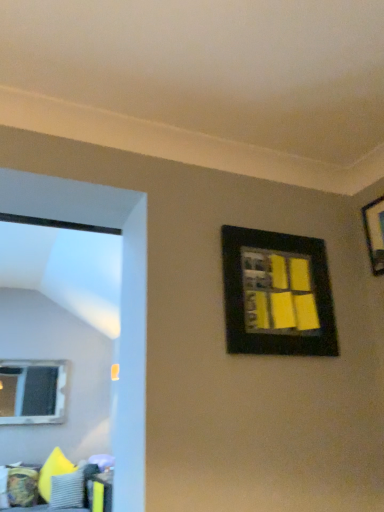
What do you see at coordinates (375, 233) in the screenshot? Image resolution: width=384 pixels, height=512 pixels. I see `black matte picture frame at upper right, the first picture frame in the right-to-left sequence` at bounding box center [375, 233].

The height and width of the screenshot is (512, 384). I want to click on clear glass window at left, so click(34, 391).

Locate an element on the screen. The image size is (384, 512). gray textured pillow at lower left is located at coordinates (68, 490).

From a real-world perspective, relative to gray textured pillow at lower left, is black matte picture frame at upper right, the 2th picture frame when ordered from right to left, vertically above or below?

In terms of real-world spatial position, black matte picture frame at upper right, the 2th picture frame when ordered from right to left, is above gray textured pillow at lower left.

Measure the distance between black matte picture frame at upper right, acting as the 1th picture frame starting from the left, and gray textured pillow at lower left.

black matte picture frame at upper right, acting as the 1th picture frame starting from the left, is 12.55 feet from gray textured pillow at lower left.

Which is in front, point (260, 271) or point (82, 466)?

The point (260, 271) is more forward.

Which is more to the right, black matte picture frame at upper right, the 2th picture frame when ordered from right to left, or gray textured pillow at lower left?

Positioned to the right is black matte picture frame at upper right, the 2th picture frame when ordered from right to left.

Which object is wider, textured fabric couch at lower left or gray textured pillow at lower left?

Wider between the two is textured fabric couch at lower left.

Is textured fabric couch at lower left to the right of gray textured pillow at lower left from the viewer's perspective?

No.

From the picture: Which is correct: textured fabric couch at lower left is inside gray textured pillow at lower left, or outside of it?

textured fabric couch at lower left is located beyond the bounds of gray textured pillow at lower left.

Could you tell me if textured fabric couch at lower left is turned towards gray textured pillow at lower left?

Yes, textured fabric couch at lower left is aimed at gray textured pillow at lower left.

Image resolution: width=384 pixels, height=512 pixels. I want to click on the 2nd picture frame to the right of the gray textured pillow at lower left, starting your count from the anchor, so click(375, 233).

How many degrees apart are the facing directions of gray textured pillow at lower left and black matte picture frame at upper right, the first picture frame in the right-to-left sequence?

gray textured pillow at lower left and black matte picture frame at upper right, the first picture frame in the right-to-left sequence, are facing 61.1 degrees away from each other.

Is gray textured pillow at lower left aimed at black matte picture frame at upper right, the first picture frame in the right-to-left sequence?

No, gray textured pillow at lower left is not facing towards black matte picture frame at upper right, the first picture frame in the right-to-left sequence.

Considering the relative positions of gray textured pillow at lower left and black matte picture frame at upper right, which is the 2th picture frame from left to right, in the image provided, is gray textured pillow at lower left to the left or to the right of black matte picture frame at upper right, which is the 2th picture frame from left to right,?

In the image, gray textured pillow at lower left appears on the left side of black matte picture frame at upper right, which is the 2th picture frame from left to right.

Measure the distance from black matte picture frame at upper right, the 2th picture frame when ordered from right to left, to clear glass window at left.

black matte picture frame at upper right, the 2th picture frame when ordered from right to left, is 5.01 meters away from clear glass window at left.

Considering the relative sizes of black matte picture frame at upper right, acting as the 1th picture frame starting from the left, and clear glass window at left in the image provided, is black matte picture frame at upper right, acting as the 1th picture frame starting from the left, bigger than clear glass window at left?

Actually, black matte picture frame at upper right, acting as the 1th picture frame starting from the left, might be smaller than clear glass window at left.

Is black matte picture frame at upper right, the 2th picture frame when ordered from right to left, far away from clear glass window at left?

Absolutely, black matte picture frame at upper right, the 2th picture frame when ordered from right to left, is distant from clear glass window at left.

Is black matte picture frame at upper right, the 2th picture frame when ordered from right to left, not within clear glass window at left?

Yes, black matte picture frame at upper right, the 2th picture frame when ordered from right to left, is not within clear glass window at left.

Considering their positions, is clear glass window at left located in front of or behind textured fabric couch at lower left?

Clearly, clear glass window at left is behind textured fabric couch at lower left.

From a real-world perspective, which object rests below the other?

textured fabric couch at lower left.

Is clear glass window at left aimed at textured fabric couch at lower left?

No, clear glass window at left is not turned towards textured fabric couch at lower left.

Considering the relative sizes of clear glass window at left and textured fabric couch at lower left in the image provided, is clear glass window at left taller than textured fabric couch at lower left?

Correct, clear glass window at left is much taller as textured fabric couch at lower left.

Does point (66, 492) appear closer or farther from the camera than point (79, 492)?

Point (66, 492).

Could you tell me if gray textured pillow at lower left is facing textured fabric couch at lower left?

Yes.

Is gray textured pillow at lower left not inside textured fabric couch at lower left?

No, gray textured pillow at lower left is inside textured fabric couch at lower left's boundary.

Is gray textured pillow at lower left taller or shorter than textured fabric couch at lower left?

In the image, gray textured pillow at lower left appears to be shorter than textured fabric couch at lower left.

Between black matte picture frame at upper right, acting as the 1th picture frame starting from the left, and textured fabric couch at lower left, which one has larger width?

textured fabric couch at lower left is wider.

Which object is more forward, black matte picture frame at upper right, the 2th picture frame when ordered from right to left, or textured fabric couch at lower left?

Positioned in front is black matte picture frame at upper right, the 2th picture frame when ordered from right to left.

From a real-world perspective, who is located lower, black matte picture frame at upper right, acting as the 1th picture frame starting from the left, or textured fabric couch at lower left?

In real-world perspective, textured fabric couch at lower left is lower.

Is black matte picture frame at upper right, acting as the 1th picture frame starting from the left, taller than textured fabric couch at lower left?

In fact, black matte picture frame at upper right, acting as the 1th picture frame starting from the left, may be shorter than textured fabric couch at lower left.

At what (x,y) coordinates should I click in order to perform the action: click on picture frame that is the 2nd object located in front of the gray textured pillow at lower left. Please return your answer as a coordinate pair (x, y). The width and height of the screenshot is (384, 512). Looking at the image, I should click on (277, 294).

The height and width of the screenshot is (512, 384). Identify the location of pillow lying above the textured fabric couch at lower left (from the image's perspective). (68, 490).

In the scene shown: When comparing their distances from gray textured pillow at lower left, does black matte picture frame at upper right, which is the 2th picture frame from left to right, or textured fabric couch at lower left seem further?

black matte picture frame at upper right, which is the 2th picture frame from left to right, lies further to gray textured pillow at lower left than the other object.

From the picture: When comparing their distances from black matte picture frame at upper right, which is the 2th picture frame from left to right, does textured fabric couch at lower left or clear glass window at left seem further?

clear glass window at left lies further to black matte picture frame at upper right, which is the 2th picture frame from left to right, than the other object.

Estimate the real-world distances between objects in this image. Which object is further from gray textured pillow at lower left, clear glass window at left or textured fabric couch at lower left?

clear glass window at left.

Based on their spatial positions, is textured fabric couch at lower left or gray textured pillow at lower left further from black matte picture frame at upper right, which is the 2th picture frame from left to right?

Based on the image, gray textured pillow at lower left appears to be further to black matte picture frame at upper right, which is the 2th picture frame from left to right.

Considering their positions, is clear glass window at left positioned further to textured fabric couch at lower left than black matte picture frame at upper right, acting as the 1th picture frame starting from the left?

black matte picture frame at upper right, acting as the 1th picture frame starting from the left, is further to textured fabric couch at lower left.

Looking at the image, which one is located closer to black matte picture frame at upper right, which is the 2th picture frame from left to right, clear glass window at left or black matte picture frame at upper right, acting as the 1th picture frame starting from the left?

black matte picture frame at upper right, acting as the 1th picture frame starting from the left.

Looking at the image, which one is located closer to black matte picture frame at upper right, the first picture frame in the right-to-left sequence, gray textured pillow at lower left or black matte picture frame at upper right, the 2th picture frame when ordered from right to left?

black matte picture frame at upper right, the 2th picture frame when ordered from right to left, is positioned closer to the anchor black matte picture frame at upper right, the first picture frame in the right-to-left sequence.

Estimate the real-world distances between objects in this image. Which object is further from textured fabric couch at lower left, black matte picture frame at upper right, the first picture frame in the right-to-left sequence, or black matte picture frame at upper right, acting as the 1th picture frame starting from the left?

The object further to textured fabric couch at lower left is black matte picture frame at upper right, the first picture frame in the right-to-left sequence.

You are a GUI agent. You are given a task and a screenshot of the screen. Output one action in this format:
    pyautogui.click(x=<x>, y=<y>)
    Task: Click on the furniture between black matte picture frame at upper right, acting as the 1th picture frame starting from the left, and gray textured pillow at lower left, along the z-axis
    This screenshot has width=384, height=512.
    Given the screenshot: What is the action you would take?
    pyautogui.click(x=22, y=486)

Identify the location of pillow between black matte picture frame at upper right, which is the 2th picture frame from left to right, and clear glass window at left from front to back. (68, 490).

Where is `picture frame positioned between black matte picture frame at upper right, the 2th picture frame when ordered from right to left, and gray textured pillow at lower left from near to far`? picture frame positioned between black matte picture frame at upper right, the 2th picture frame when ordered from right to left, and gray textured pillow at lower left from near to far is located at coordinates (375, 233).

The width and height of the screenshot is (384, 512). I want to click on pillow between black matte picture frame at upper right, which is the 2th picture frame from left to right, and textured fabric couch at lower left in the up-down direction, so click(x=68, y=490).